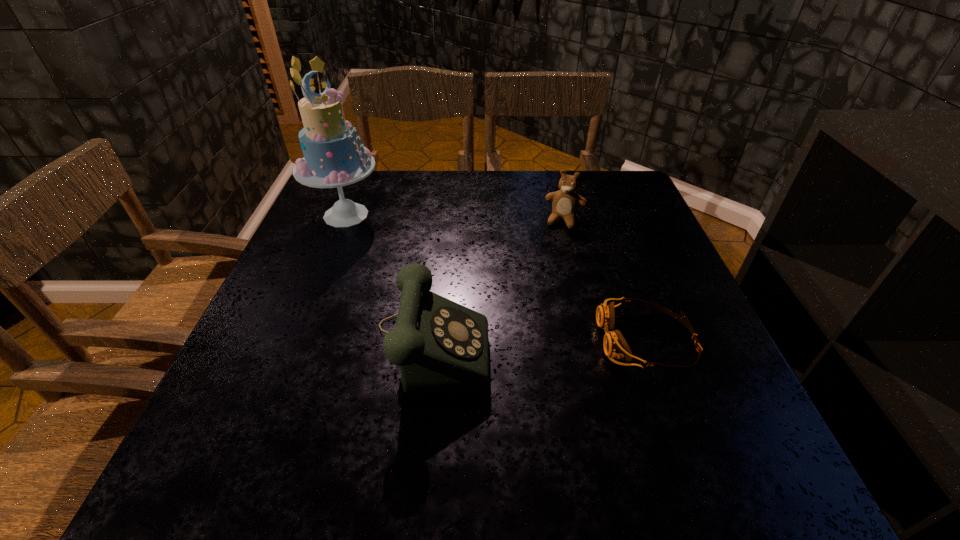
Find the location of `telephone`. telephone is located at coordinates (441, 347).

The image size is (960, 540). In order to click on the third object from right to left in this screenshot , I will do `click(441, 347)`.

Identify the location of the shortest object. (615, 346).

Find the location of a particular element. The height and width of the screenshot is (540, 960). teddy bear is located at coordinates (565, 204).

Identify the location of the tallest object. (332, 159).

Where is `the leftmost object`? the leftmost object is located at coordinates pos(332,159).

This screenshot has height=540, width=960. In order to click on free point located 0.280m on the dial of the third shortest object in this screenshot , I will do `click(632, 339)`.

Identify the location of vacant point located 0.160m with the lenses facing forward on the goggles. This screenshot has width=960, height=540. (517, 340).

Locate an element on the screen. This screenshot has height=540, width=960. vacant space positioned 0.250m with the lenses facing forward on the goggles is located at coordinates (470, 340).

I want to click on vacant space located with the lenses facing forward on the goggles, so click(x=455, y=340).